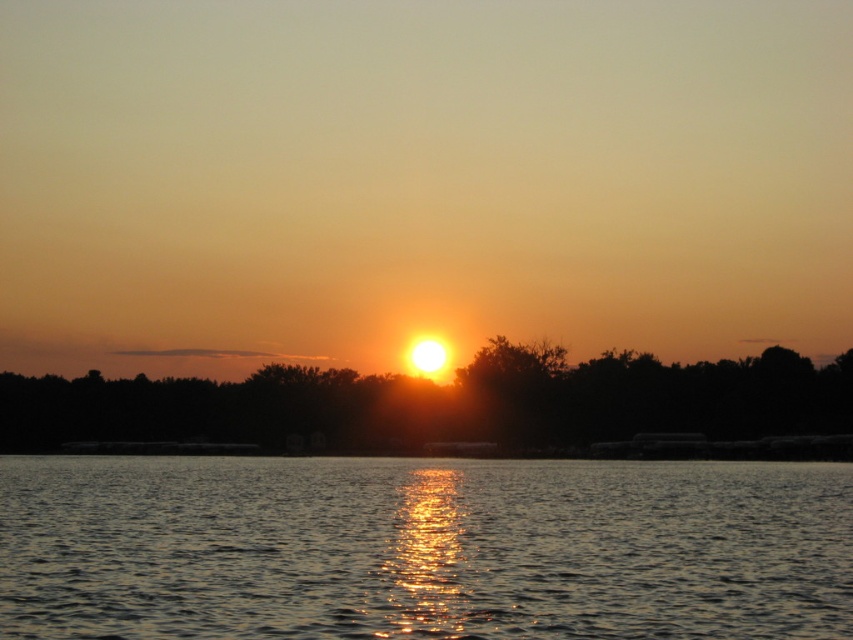
Question: Is glistening water at center behind golden reflective water at center?

Choices:
 (A) no
 (B) yes

Answer: (A)

Question: Which point is closer to the camera?

Choices:
 (A) (573, 396)
 (B) (349, 506)

Answer: (B)

Question: Can you confirm if glistening water at center is bigger than golden reflective water at center?

Choices:
 (A) no
 (B) yes

Answer: (A)

Question: Does glistening water at center have a greater width compared to golden reflective water at center?

Choices:
 (A) yes
 (B) no

Answer: (B)